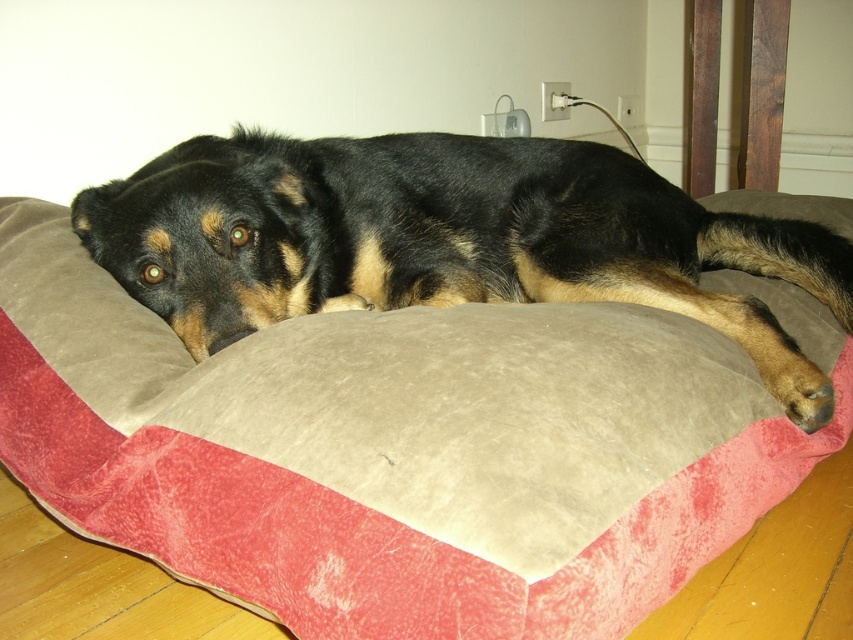
Question: Among these points, which one is farthest from the camera?

Choices:
 (A) (631, 531)
 (B) (141, 266)

Answer: (B)

Question: Does velvet-like beige and red dog bed at center have a lesser width compared to black fur dog at center?

Choices:
 (A) yes
 (B) no

Answer: (B)

Question: Is velvet-like beige and red dog bed at center bigger than black fur dog at center?

Choices:
 (A) yes
 (B) no

Answer: (A)

Question: Can you confirm if velvet-like beige and red dog bed at center is positioned below black fur dog at center?

Choices:
 (A) no
 (B) yes

Answer: (B)